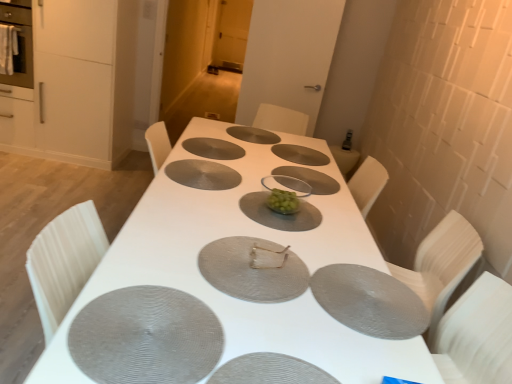
I want to click on free space underneath gray textured placemat at lower right, which is the third pizza pan from front to back (from a real-world perspective), so click(x=354, y=291).